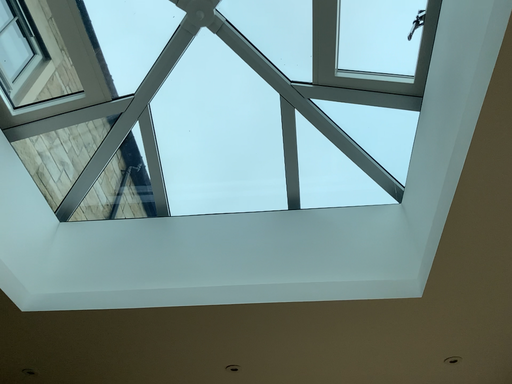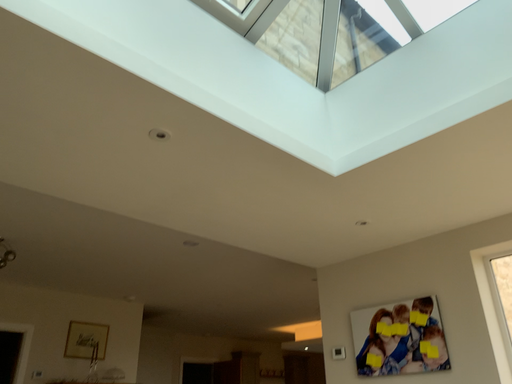
Question: How did the camera likely rotate when shooting the video?

Choices:
 (A) rotated upward
 (B) rotated downward

Answer: (B)